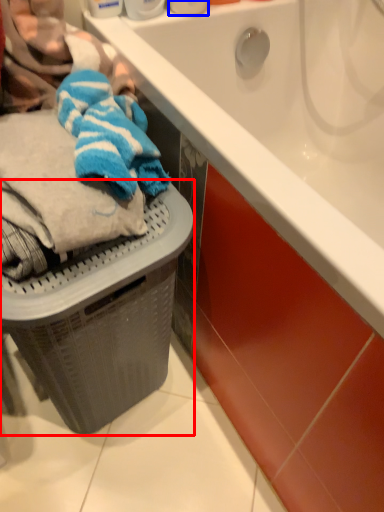
Question: Which object is closer to the camera taking this photo, basket container (highlighted by a red box) or toiletry (highlighted by a blue box)?

Choices:
 (A) basket container
 (B) toiletry

Answer: (A)